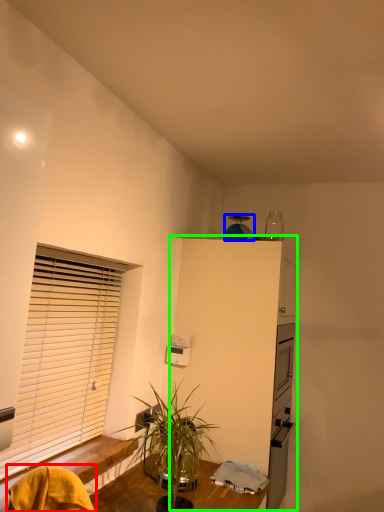
Question: Estimate the real-world distances between objects in this image. Which object is closer to swivel chair (highlighted by a red box), appliance (highlighted by a blue box) or dresser (highlighted by a green box)?

Choices:
 (A) appliance
 (B) dresser

Answer: (B)